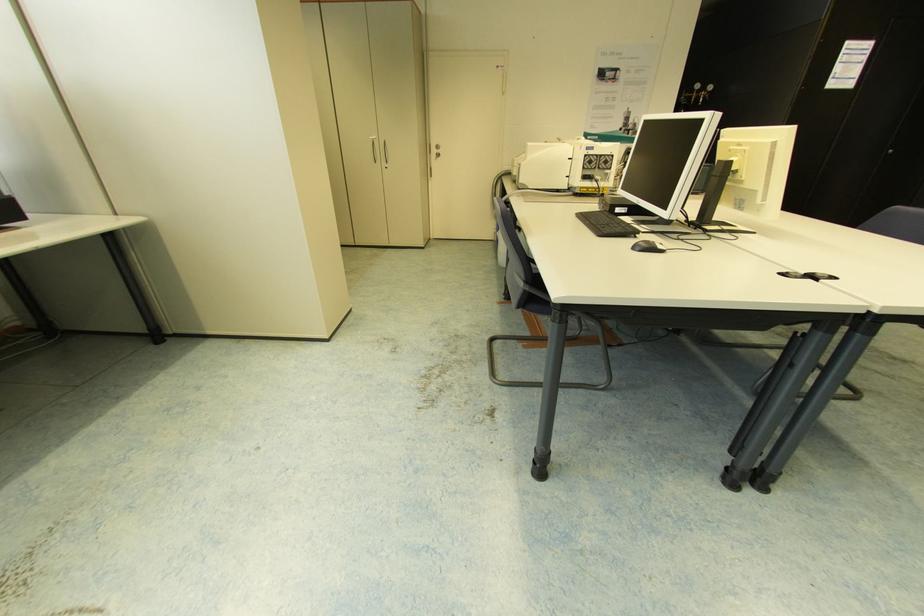
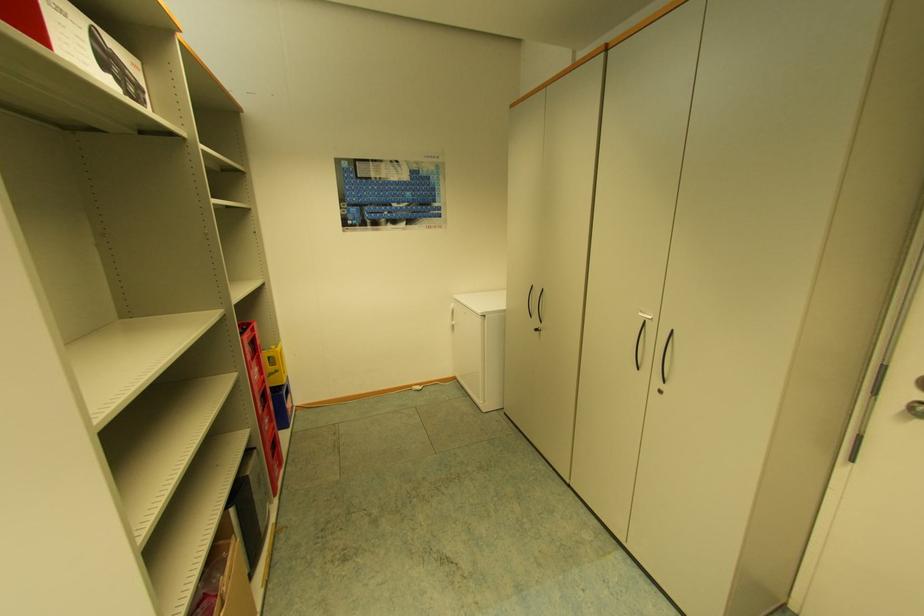
In the second image, find the point that corresponds to (439,156) in the first image.

(907, 408)